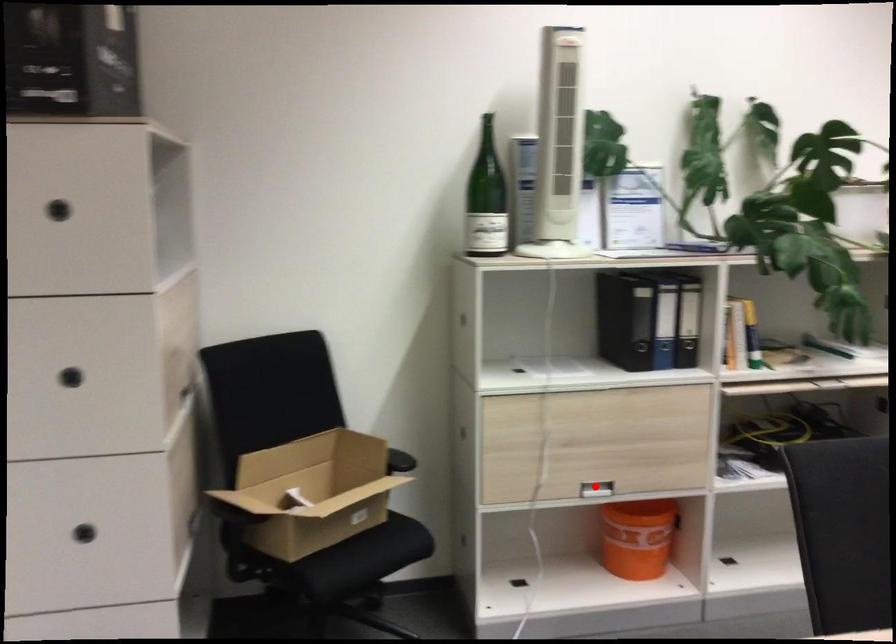
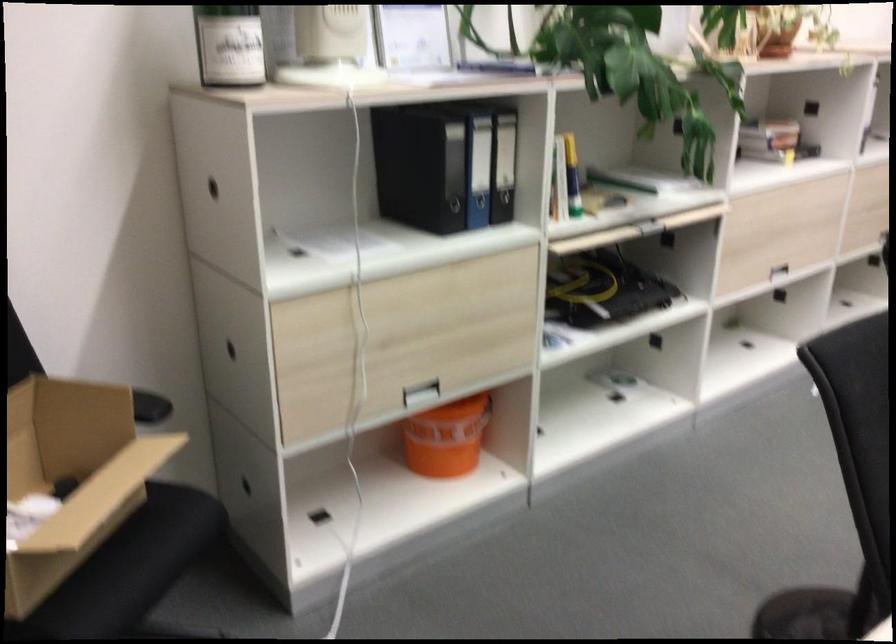
In the second image, find the point that corresponds to the highlighted location in the first image.

(419, 393)